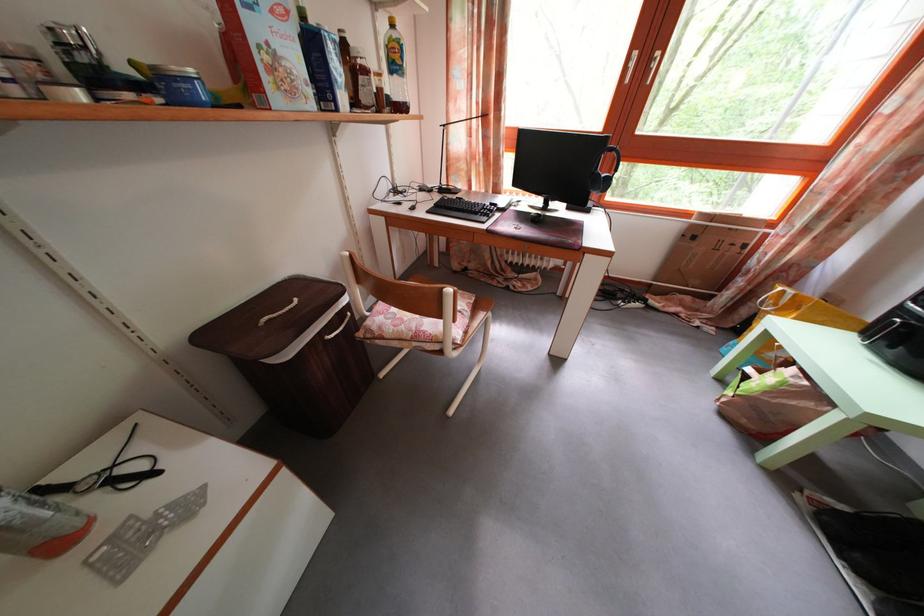
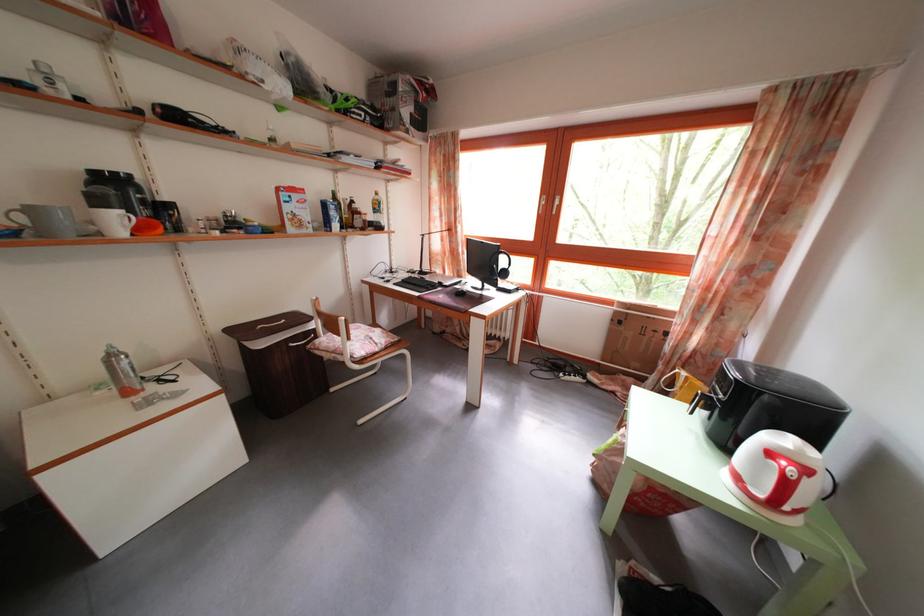
In the second image, find the point that corresponds to the point at 699,233 in the first image.

(623, 320)